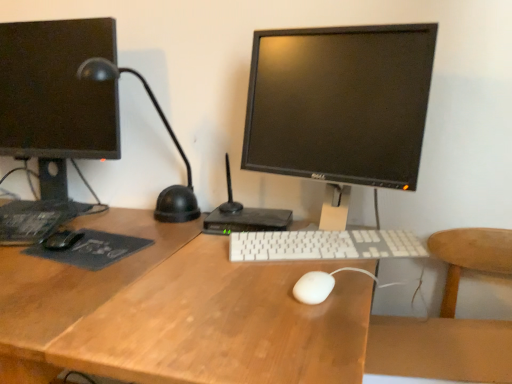
Find the location of `unoccupied area behind black matte mouse at left, which is the 1th mouse in left-to-right order`. unoccupied area behind black matte mouse at left, which is the 1th mouse in left-to-right order is located at coordinates (106, 217).